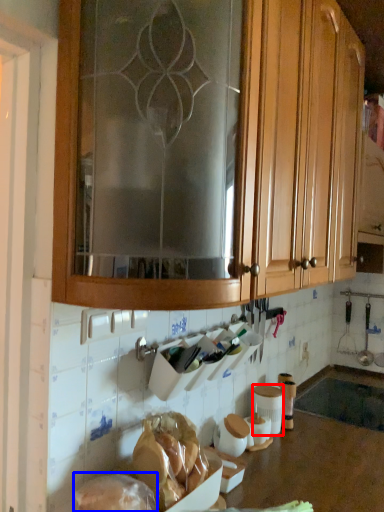
Question: Which point is further to the camera, pottery (highlighted by a red box) or food (highlighted by a blue box)?

Choices:
 (A) pottery
 (B) food

Answer: (A)